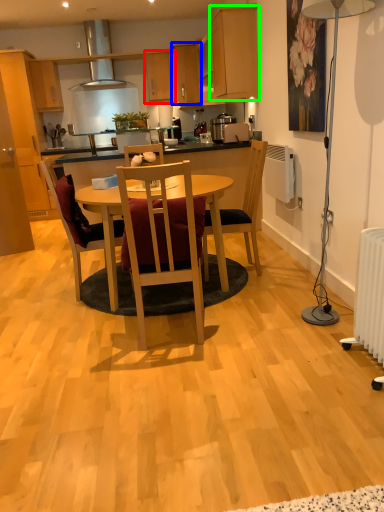
Question: Which object is the closest to the cabinetry (highlighted by a red box)? Choose among these: cabinetry (highlighted by a blue box) or cabinetry (highlighted by a green box).

Choices:
 (A) cabinetry
 (B) cabinetry

Answer: (A)